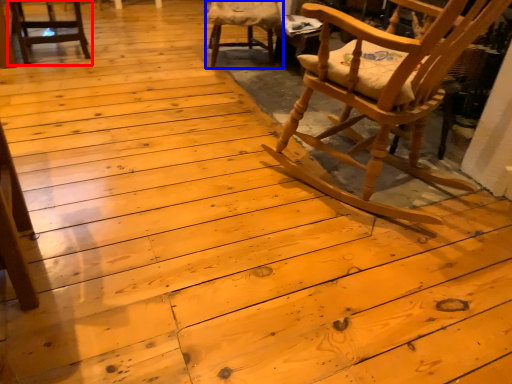
Question: Which object is closer to the camera taking this photo, chair (highlighted by a red box) or chair (highlighted by a blue box)?

Choices:
 (A) chair
 (B) chair

Answer: (A)